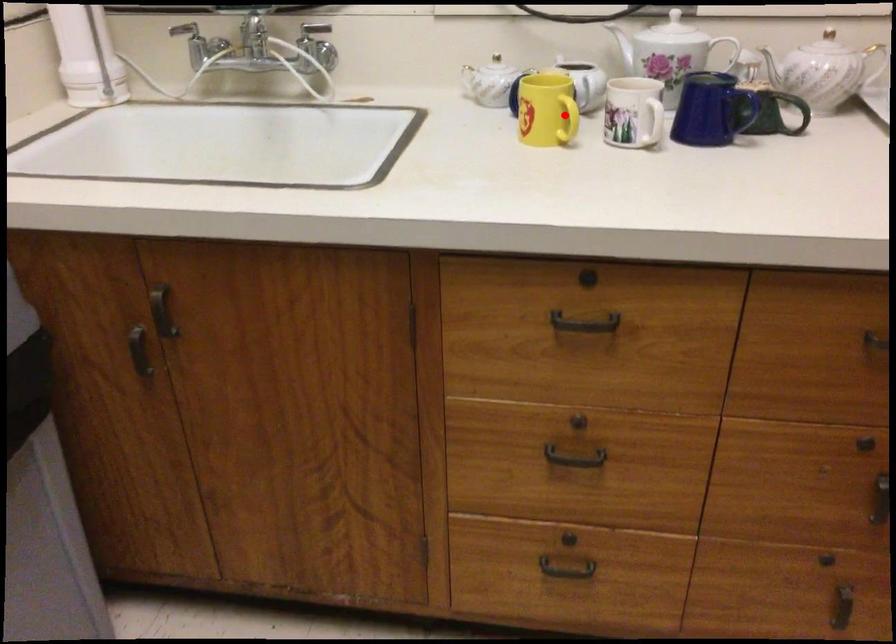
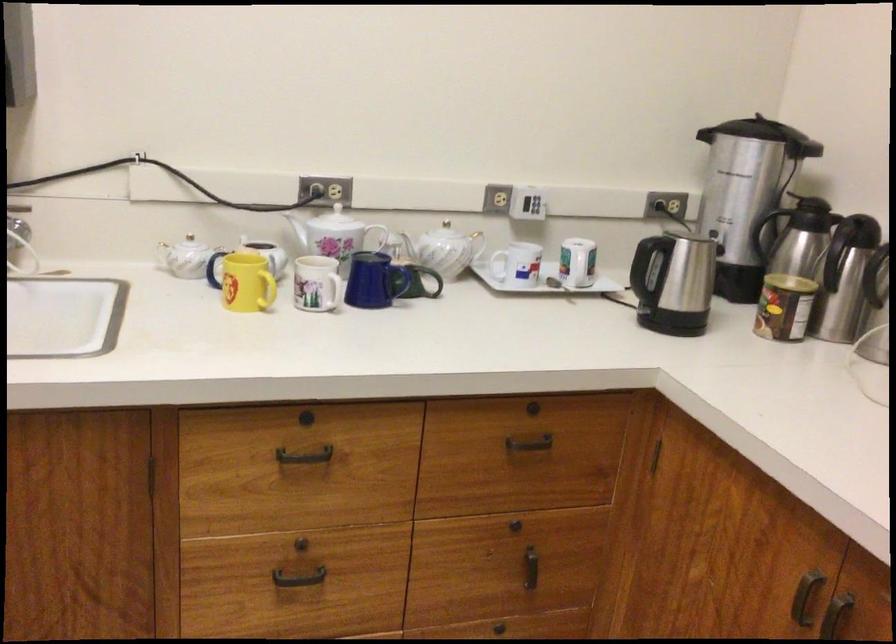
The point at the highlighted location is marked in the first image. Where is the corresponding point in the second image?

(268, 289)